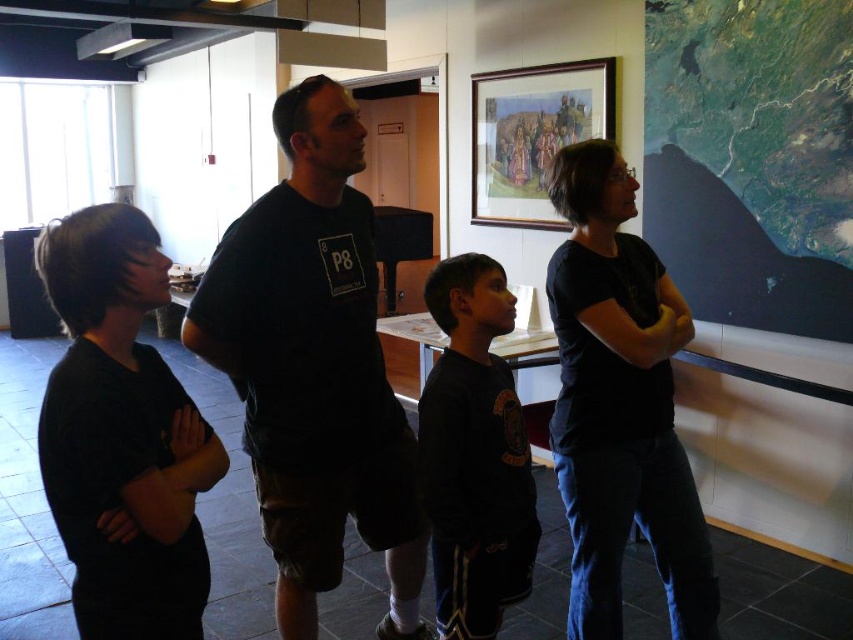
Question: Does dark matte shirt at center lie in front of wooden framed picture at upper center?

Choices:
 (A) no
 (B) yes

Answer: (B)

Question: Which of the following is the closest to the observer?

Choices:
 (A) dark matte shirt at center
 (B) black matte shirt at right
 (C) dark matte t-shirt at center

Answer: (A)

Question: Among these points, which one is nearest to the camera?

Choices:
 (A) (109, 540)
 (B) (347, 321)
 (C) (645, 328)
 (D) (508, 515)

Answer: (A)

Question: Is black matte shirt at left below dark matte shirt at center?

Choices:
 (A) yes
 (B) no

Answer: (B)

Question: Does black matte shirt at left have a smaller size compared to dark matte shirt at center?

Choices:
 (A) no
 (B) yes

Answer: (A)

Question: Among these objects, which one is farthest from the camera?

Choices:
 (A) dark matte t-shirt at center
 (B) black matte shirt at left
 (C) dark matte shirt at center

Answer: (A)